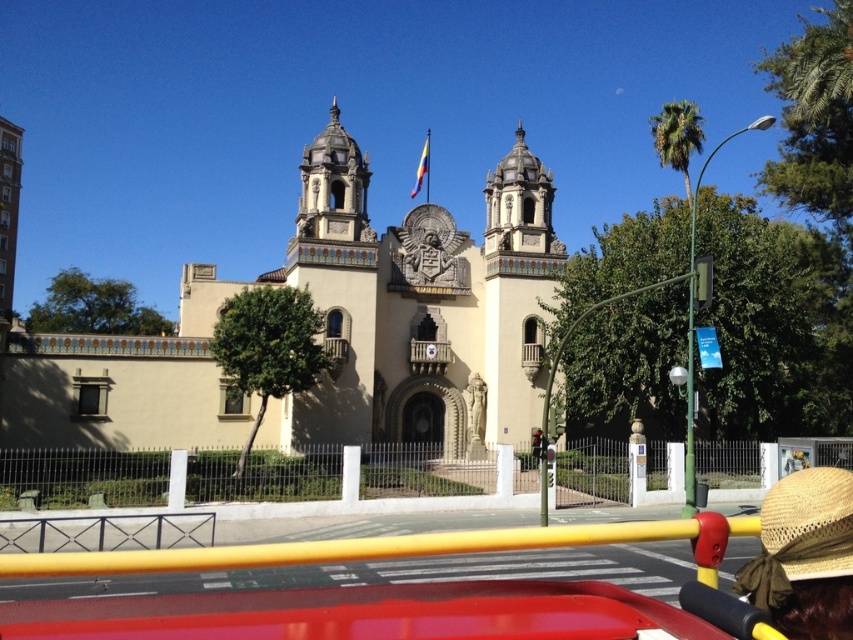
From the picture: Is beige stone church at center positioned behind straw at center?

Yes, it is behind straw at center.

Who is positioned more to the left, beige stone church at center or straw at center?

Positioned to the left is beige stone church at center.

Between point (212, 301) and point (819, 476), which one is positioned in front?

Point (819, 476) is in front.

Where is `beige stone church at center`? beige stone church at center is located at coordinates (331, 330).